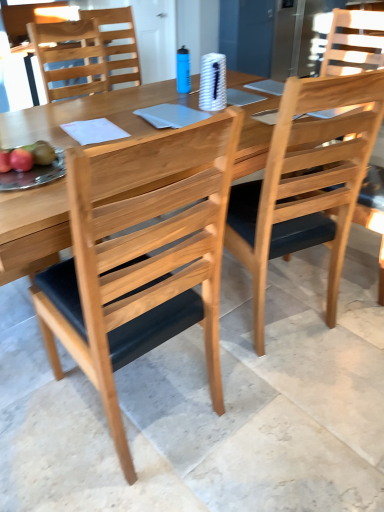
Question: Considering the positions of shiny red apple at left, the first fruit in the back-to-front sequence, and natural wood chair at upper left, acting as the 1th chair starting from the back, in the image, is shiny red apple at left, the first fruit in the back-to-front sequence, wider or thinner than natural wood chair at upper left, acting as the 1th chair starting from the back,?

Choices:
 (A) thin
 (B) wide

Answer: (A)

Question: From the image's perspective, is shiny red apple at left, the first fruit in the back-to-front sequence, positioned above or below natural wood chair at upper left, which is the third chair in front-to-back order?

Choices:
 (A) above
 (B) below

Answer: (B)

Question: Based on their relative distances, which object is farther from the natural wood chair at upper left, acting as the 1th chair starting from the back?

Choices:
 (A) natural wood table at center
 (B) shiny red apple at left, arranged as the 1th fruit when viewed from the front
 (C) natural wood chair at center, placed as the third chair when sorted from back to front
 (D) shiny red apple at left, the first fruit in the back-to-front sequence
 (E) light brown wood chair at center, marked as the second chair in a back-to-front arrangement

Answer: (C)

Question: Considering the real-world distances, which object is farthest from the shiny red apple at left, the first fruit in the back-to-front sequence?

Choices:
 (A) natural wood chair at center, placed as the third chair when sorted from back to front
 (B) light brown wood chair at center, acting as the second chair starting from the front
 (C) shiny red apple at left, which appears as the 2th fruit when viewed from the back
 (D) natural wood table at center
 (E) natural wood chair at upper left, acting as the 1th chair starting from the back

Answer: (E)